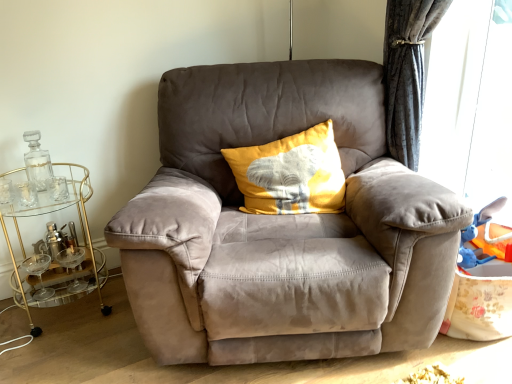
What do you see at coordinates (291, 174) in the screenshot? I see `yellow fabric pillow at center` at bounding box center [291, 174].

The height and width of the screenshot is (384, 512). Identify the location of transparent plastic window screen at right. (x=470, y=106).

Is suede gray armchair at center taller than gold glass bar cart at left?

Indeed, suede gray armchair at center has a greater height compared to gold glass bar cart at left.

Is suede gray armchair at center to the right of gold glass bar cart at left from the viewer's perspective?

Yes.

Does point (193, 110) come farther from viewer compared to point (75, 183)?

No, it is in front of (75, 183).

From the image's perspective, would you say suede gray armchair at center is positioned over transparent plastic window screen at right?

No, from the image's perspective, suede gray armchair at center is not over transparent plastic window screen at right.

Between suede gray armchair at center and transparent plastic window screen at right, which one appears on the right side from the viewer's perspective?

transparent plastic window screen at right.

Is suede gray armchair at center oriented away from transparent plastic window screen at right?

No, transparent plastic window screen at right is not at the back of suede gray armchair at center.

From a real-world perspective, is suede gray armchair at center positioned over transparent plastic window screen at right based on gravity?

No, from a real-world perspective, suede gray armchair at center is not over transparent plastic window screen at right

Consider the image. Would you say gold glass bar cart at left is inside or outside clear glass bottle at left?

The correct answer is: outside.

Who is taller, gold glass bar cart at left or clear glass bottle at left?

gold glass bar cart at left is taller.

From the image's perspective, relative to clear glass bottle at left, is gold glass bar cart at left above or below?

Clearly, from the image's perspective, gold glass bar cart at left is below clear glass bottle at left.

Are gold glass bar cart at left and clear glass bottle at left located far from each other?

No, there isn't a large distance between gold glass bar cart at left and clear glass bottle at left.

From the image's perspective, is clear glass bottle at left under suede gray armchair at center?

Incorrect, from the image's perspective, clear glass bottle at left is higher than suede gray armchair at center.

Considering the sizes of objects clear glass bottle at left and suede gray armchair at center in the image provided, who is thinner, clear glass bottle at left or suede gray armchair at center?

clear glass bottle at left is thinner.

From the image's perspective, between clear glass bottle at left and yellow fabric pillow at center, which one is located above?

yellow fabric pillow at center, from the image's perspective.

Measure the distance from clear glass bottle at left to yellow fabric pillow at center.

They are 3.37 feet apart.

Can yellow fabric pillow at center be found inside clear glass bottle at left?

No, yellow fabric pillow at center is not a part of clear glass bottle at left.

In order to click on pillow below the clear glass bottle at left (from a real-world perspective) in this screenshot , I will do `click(291, 174)`.

Where is `table located on the left of transparent plastic window screen at right`? This screenshot has height=384, width=512. table located on the left of transparent plastic window screen at right is located at coordinates (54, 242).

From a real-world perspective, is transparent plastic window screen at right above or below gold glass bar cart at left?

transparent plastic window screen at right is situated higher than gold glass bar cart at left in the real world.

Which is behind, point (430, 127) or point (51, 193)?

The point (51, 193) is more distant.

Is transparent plastic window screen at right turned away from gold glass bar cart at left?

transparent plastic window screen at right is not turned away from gold glass bar cart at left.

From the image's perspective, who appears lower, gold glass bar cart at left or transparent plastic window screen at right?

From the image's view, gold glass bar cart at left is below.

This screenshot has width=512, height=384. In order to click on table that appears on the left of transparent plastic window screen at right in this screenshot , I will do `click(54, 242)`.

You are a GUI agent. You are given a task and a screenshot of the screen. Output one action in this format:
    pyautogui.click(x=<x>, y=<y>)
    Task: Click on the chair on the right of the gold glass bar cart at left
    This screenshot has width=512, height=384.
    Given the screenshot: What is the action you would take?
    pyautogui.click(x=282, y=226)

Identify the location of chair below the transparent plastic window screen at right (from the image's perspective). The width and height of the screenshot is (512, 384). (282, 226).

Considering their positions, is transparent plastic window screen at right positioned further to gold glass bar cart at left than yellow fabric pillow at center?

transparent plastic window screen at right is positioned further to the anchor gold glass bar cart at left.

When comparing their distances from transparent plastic window screen at right, does clear glass bottle at left or gold glass bar cart at left seem closer?

Among the two, gold glass bar cart at left is located nearer to transparent plastic window screen at right.

Based on their spatial positions, is yellow fabric pillow at center or transparent plastic window screen at right closer to clear glass bottle at left?

yellow fabric pillow at center lies closer to clear glass bottle at left than the other object.

Looking at this image, considering their positions, is suede gray armchair at center positioned closer to transparent plastic window screen at right than yellow fabric pillow at center?

suede gray armchair at center lies closer to transparent plastic window screen at right than the other object.

Looking at the image, which one is located further to clear glass bottle at left, suede gray armchair at center or transparent plastic window screen at right?

The object further to clear glass bottle at left is transparent plastic window screen at right.

Which object lies further to the anchor point suede gray armchair at center, yellow fabric pillow at center or clear glass bottle at left?

The object further to suede gray armchair at center is clear glass bottle at left.

Estimate the real-world distances between objects in this image. Which object is further from gold glass bar cart at left, suede gray armchair at center or clear glass bottle at left?

Based on the image, suede gray armchair at center appears to be further to gold glass bar cart at left.

Looking at the image, which one is located further to transparent plastic window screen at right, gold glass bar cart at left or suede gray armchair at center?

The object further to transparent plastic window screen at right is gold glass bar cart at left.

Find the location of a particular element. Image resolution: width=512 pixels, height=384 pixels. chair located between gold glass bar cart at left and yellow fabric pillow at center in the left-right direction is located at coordinates (282, 226).

Identify the location of chair between gold glass bar cart at left and transparent plastic window screen at right from left to right. This screenshot has width=512, height=384. (282, 226).

This screenshot has width=512, height=384. What are the coordinates of `pillow located between suede gray armchair at center and transparent plastic window screen at right in the left-right direction` in the screenshot? It's located at (291, 174).

Where is `chair situated between clear glass bottle at left and yellow fabric pillow at center from left to right`? This screenshot has height=384, width=512. chair situated between clear glass bottle at left and yellow fabric pillow at center from left to right is located at coordinates (282, 226).